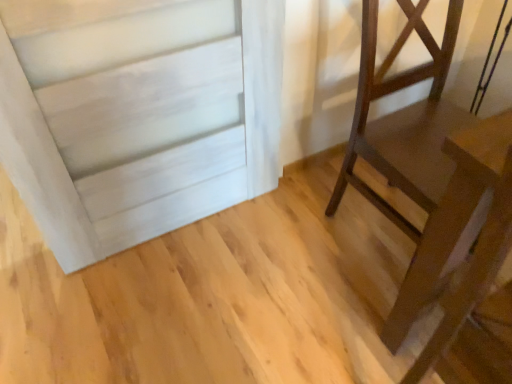
Question: Is wooden table at lower right looking in the opposite direction of dark brown wood chair at right?

Choices:
 (A) no
 (B) yes

Answer: (A)

Question: Is wooden table at lower right taller than dark brown wood chair at right?

Choices:
 (A) no
 (B) yes

Answer: (B)

Question: Is wooden table at lower right facing towards dark brown wood chair at right?

Choices:
 (A) no
 (B) yes

Answer: (A)

Question: Does wooden table at lower right have a smaller size compared to dark brown wood chair at right?

Choices:
 (A) no
 (B) yes

Answer: (B)

Question: Would you say wooden table at lower right is outside dark brown wood chair at right?

Choices:
 (A) yes
 (B) no

Answer: (A)

Question: Is dark brown wood chair at right located within wooden table at lower right?

Choices:
 (A) no
 (B) yes

Answer: (A)

Question: Is dark brown wood chair at right bigger than wooden table at lower right?

Choices:
 (A) yes
 (B) no

Answer: (A)

Question: Considering the relative sizes of dark brown wood chair at right and wooden table at lower right in the image provided, is dark brown wood chair at right shorter than wooden table at lower right?

Choices:
 (A) no
 (B) yes

Answer: (B)

Question: From a real-world perspective, does dark brown wood chair at right sit lower than wooden table at lower right?

Choices:
 (A) yes
 (B) no

Answer: (A)

Question: Are dark brown wood chair at right and wooden table at lower right located far from each other?

Choices:
 (A) no
 (B) yes

Answer: (A)

Question: Does dark brown wood chair at right appear on the right side of wooden table at lower right?

Choices:
 (A) no
 (B) yes

Answer: (B)

Question: Is dark brown wood chair at right outside wooden table at lower right?

Choices:
 (A) yes
 (B) no

Answer: (A)

Question: Is wooden table at lower right taller or shorter than dark brown wood chair at right?

Choices:
 (A) tall
 (B) short

Answer: (A)